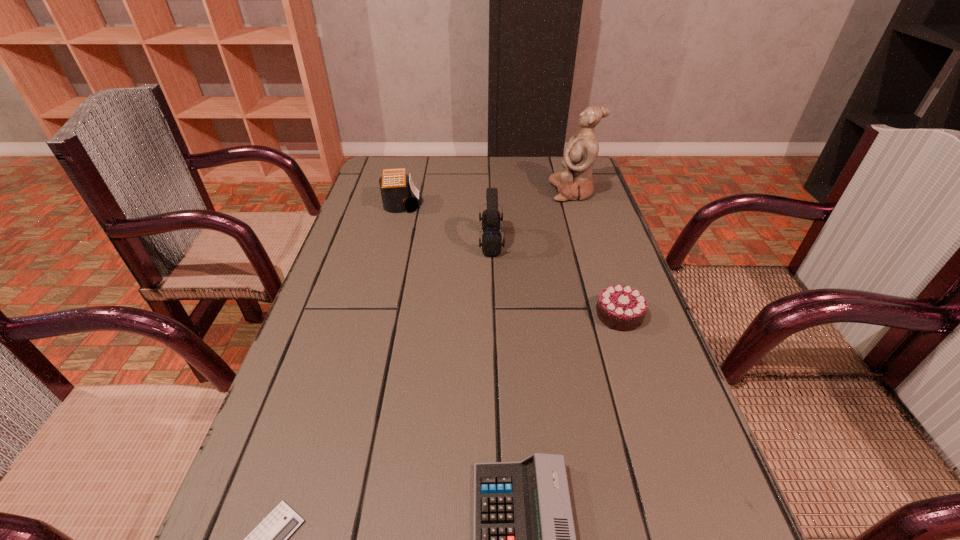
Point out which calculator is positioned as the nearest to the headset. Please provide its 2D coordinates. Your answer should be formatted as a tuple, i.e. [(x, y)], where the tuple contains the x and y coordinates of a point satisfying the conditions above.

[(395, 185)]

The image size is (960, 540). Find the location of `free space that satisfies the following two spatial constraints: 1. on the front-facing side of the chocolate cake; 2. on the right side of the tallest object`. free space that satisfies the following two spatial constraints: 1. on the front-facing side of the chocolate cake; 2. on the right side of the tallest object is located at coordinates (612, 315).

What are the coordinates of `vacant point that satisfies the following two spatial constraints: 1. on the headband of the chocolate cake; 2. on the left side of the headset` in the screenshot? It's located at (493, 315).